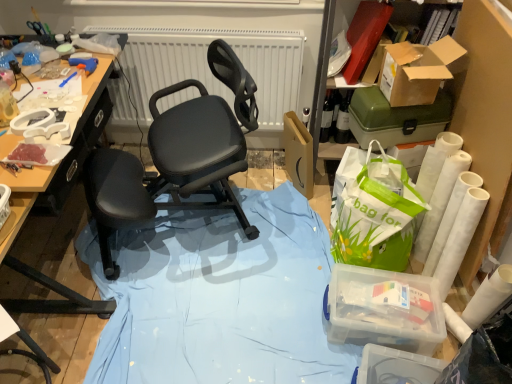
Image resolution: width=512 pixels, height=384 pixels. In order to click on blank space situated above white matte radiator at upper center (from a real-world perspective) in this screenshot , I will do `click(209, 23)`.